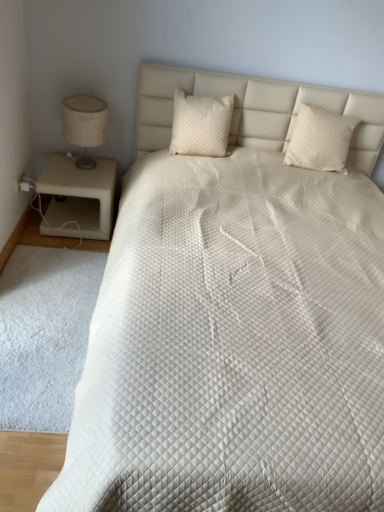
This screenshot has width=384, height=512. What do you see at coordinates (44, 334) in the screenshot? I see `white fluffy rug at lower left` at bounding box center [44, 334].

Locate an element on the screen. white quilted pillow at center, marked as the 2th pillow in a left-to-right arrangement is located at coordinates (320, 139).

What are the coordinates of `beige fabric lampshade at left` in the screenshot? It's located at (84, 125).

Image resolution: width=384 pixels, height=512 pixels. Describe the element at coordinates (84, 125) in the screenshot. I see `beige fabric lampshade at left` at that location.

Where is `white fluffy rug at lower left`? The width and height of the screenshot is (384, 512). white fluffy rug at lower left is located at coordinates (44, 334).

Where is `mat located underneath the beige matte nightstand at left (from a real-world perspective)`? The image size is (384, 512). mat located underneath the beige matte nightstand at left (from a real-world perspective) is located at coordinates (44, 334).

Looking at their sizes, would you say beige matte nightstand at left is wider or thinner than white fluffy rug at lower left?

Clearly, beige matte nightstand at left has less width compared to white fluffy rug at lower left.

Considering the sizes of objects beige matte nightstand at left and white fluffy rug at lower left in the image provided, who is smaller, beige matte nightstand at left or white fluffy rug at lower left?

white fluffy rug at lower left.

How many degrees apart are the facing directions of beige matte nightstand at left and white fluffy rug at lower left?

There is a 2.08-degree angle between the facing directions of beige matte nightstand at left and white fluffy rug at lower left.

From a real-world perspective, which object stands above the other?

white quilted pillow at center, marked as the 2th pillow in a right-to-left arrangement, is physically above.

Does point (65, 106) come farther from viewer compared to point (218, 134)?

No.

Considering the relative sizes of beige fabric lampshade at left and white quilted pillow at center, marked as the 2th pillow in a right-to-left arrangement, in the image provided, is beige fabric lampshade at left wider than white quilted pillow at center, marked as the 2th pillow in a right-to-left arrangement,?

Yes, beige fabric lampshade at left is wider than white quilted pillow at center, marked as the 2th pillow in a right-to-left arrangement.

Is beige fabric lampshade at left positioned behind white quilted pillow at center, marked as the 2th pillow in a right-to-left arrangement?

Yes, beige fabric lampshade at left is behind white quilted pillow at center, marked as the 2th pillow in a right-to-left arrangement.

Are white fluffy rug at lower left and beige fabric lampshade at left far apart?

No, white fluffy rug at lower left is not far away from beige fabric lampshade at left.

Consider the image. How far apart are white fluffy rug at lower left and beige fabric lampshade at left?

white fluffy rug at lower left and beige fabric lampshade at left are 87.42 centimeters apart from each other.

Is beige fabric lampshade at left completely or partially inside white fluffy rug at lower left?

Definitely not — beige fabric lampshade at left is not inside white fluffy rug at lower left.

Is point (69, 364) in front of point (91, 169)?

Yes, point (69, 364) is in front of point (91, 169).

From the image's perspective, is white quilted pillow at center, which is the first pillow from right to left, on top of white quilted pillow at center, which is the 1th pillow in left-to-right order?

Incorrect, from the image's perspective, white quilted pillow at center, which is the first pillow from right to left, is lower than white quilted pillow at center, which is the 1th pillow in left-to-right order.

From a real-world perspective, between white quilted pillow at center, which is the first pillow from right to left, and white quilted pillow at center, marked as the 2th pillow in a right-to-left arrangement, who is vertically lower?

In real-world perspective, white quilted pillow at center, marked as the 2th pillow in a right-to-left arrangement, is lower.

How many degrees apart are the facing directions of white quilted pillow at center, which is the first pillow from right to left, and white quilted pillow at center, which is the 1th pillow in left-to-right order?

The facing directions of white quilted pillow at center, which is the first pillow from right to left, and white quilted pillow at center, which is the 1th pillow in left-to-right order, are 2.75 degrees apart.

Based on the photo, which is behind, white fluffy rug at lower left or beige matte nightstand at left?

beige matte nightstand at left is further away from the camera.

Is point (60, 321) less distant than point (43, 187)?

Yes.

Does white fluffy rug at lower left have a lesser width compared to beige matte nightstand at left?

In fact, white fluffy rug at lower left might be wider than beige matte nightstand at left.

The image size is (384, 512). In order to click on nightstand located behind the white fluffy rug at lower left in this screenshot , I will do `click(78, 197)`.

From the picture: Is beige fabric lampshade at left facing towards white fluffy rug at lower left?

Yes, beige fabric lampshade at left faces towards white fluffy rug at lower left.

From the image's perspective, would you say beige fabric lampshade at left is positioned over white fluffy rug at lower left?

Correct, beige fabric lampshade at left appears higher than white fluffy rug at lower left in the image.

Which is closer to the camera, (77,126) or (16,297)?

Clearly, point (77,126) is more distant from the camera than point (16,297).

You are a GUI agent. You are given a task and a screenshot of the screen. Output one action in this format:
    pyautogui.click(x=<x>, y=<y>)
    Task: Click on the nightstand below the beige fabric lampshade at left (from a real-world perspective)
    Image resolution: width=384 pixels, height=512 pixels.
    Given the screenshot: What is the action you would take?
    pyautogui.click(x=78, y=197)

Is beige matte nightstand at left touching beige fabric lampshade at left?

No, beige matte nightstand at left is not making contact with beige fabric lampshade at left.

Is beige fabric lampshade at left at the back of beige matte nightstand at left?

No.

Find the location of a particular element. The width and height of the screenshot is (384, 512). mat below the beige matte nightstand at left (from a real-world perspective) is located at coordinates (44, 334).

Where is `the 1st pillow to the right of the beige fabric lampshade at left, counting from the anchor's position`? This screenshot has width=384, height=512. the 1st pillow to the right of the beige fabric lampshade at left, counting from the anchor's position is located at coordinates (200, 125).

Estimate the real-world distances between objects in this image. Which object is closer to beige fabric lampshade at left, beige matte nightstand at left or white fluffy rug at lower left?

The object closer to beige fabric lampshade at left is beige matte nightstand at left.

From the image, which object appears to be nearer to white fluffy rug at lower left, white quilted pillow at center, which is the 1th pillow in left-to-right order, or beige matte nightstand at left?

beige matte nightstand at left is positioned closer to the anchor white fluffy rug at lower left.

From the image, which object appears to be nearer to beige matte nightstand at left, beige fabric lampshade at left or white quilted pillow at center, marked as the 2th pillow in a right-to-left arrangement?

beige fabric lampshade at left is positioned closer to the anchor beige matte nightstand at left.

When comparing their distances from white quilted pillow at center, which is the first pillow from right to left, does white fluffy rug at lower left or white quilted pillow at center, which is the 1th pillow in left-to-right order, seem closer?

white quilted pillow at center, which is the 1th pillow in left-to-right order, is positioned closer to the anchor white quilted pillow at center, which is the first pillow from right to left.

When comparing their distances from white quilted pillow at center, which is the 1th pillow in left-to-right order, does white fluffy rug at lower left or beige matte nightstand at left seem closer?

Based on the image, beige matte nightstand at left appears to be nearer to white quilted pillow at center, which is the 1th pillow in left-to-right order.

From the image, which object appears to be farther from white quilted pillow at center, which is the 1th pillow in left-to-right order, white quilted pillow at center, marked as the 2th pillow in a left-to-right arrangement, or beige matte nightstand at left?

beige matte nightstand at left is further to white quilted pillow at center, which is the 1th pillow in left-to-right order.

Considering their positions, is white quilted pillow at center, which is the first pillow from right to left, positioned closer to beige fabric lampshade at left than beige matte nightstand at left?

beige matte nightstand at left lies closer to beige fabric lampshade at left than the other object.

Based on their spatial positions, is beige fabric lampshade at left or beige matte nightstand at left closer to white quilted pillow at center, marked as the 2th pillow in a right-to-left arrangement?

beige fabric lampshade at left is positioned closer to the anchor white quilted pillow at center, marked as the 2th pillow in a right-to-left arrangement.

Locate an element on the screen. The image size is (384, 512). table lamp between white quilted pillow at center, which is the 1th pillow in left-to-right order, and white fluffy rug at lower left from top to bottom is located at coordinates (84, 125).

This screenshot has height=512, width=384. In order to click on pillow between white fluffy rug at lower left and white quilted pillow at center, marked as the 2th pillow in a left-to-right arrangement, from left to right in this screenshot , I will do `click(200, 125)`.

Identify the location of table lamp between beige matte nightstand at left and white quilted pillow at center, marked as the 2th pillow in a left-to-right arrangement, in the horizontal direction. (84, 125).

Image resolution: width=384 pixels, height=512 pixels. In order to click on nightstand situated between white fluffy rug at lower left and white quilted pillow at center, which is the first pillow from right to left, from left to right in this screenshot , I will do `click(78, 197)`.